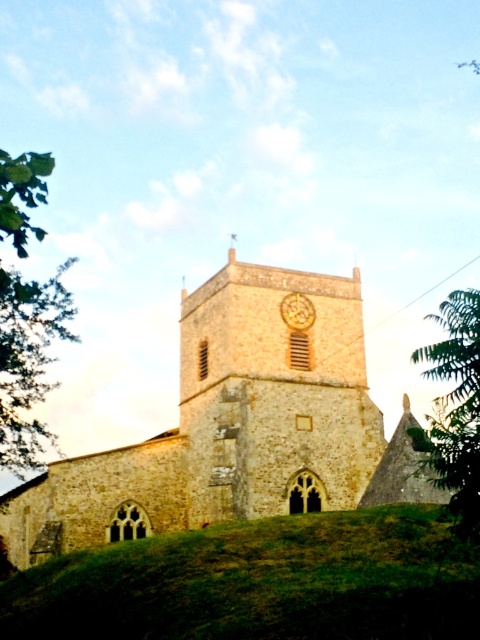
Does green grassy hill at lower center appear on the left side of gold textured clock at center?

Yes, green grassy hill at lower center is to the left of gold textured clock at center.

Is green grassy hill at lower center in front of gold textured clock at center?

That is True.

Is point (85, 605) farther from viewer compared to point (299, 305)?

That is False.

Locate an element on the screen. The image size is (480, 640). green grassy hill at lower center is located at coordinates (261, 582).

Between green grassy hill at lower center and stone clock tower at center, which one appears on the right side from the viewer's perspective?

Positioned to the right is stone clock tower at center.

Does green grassy hill at lower center lie in front of stone clock tower at center?

That is True.

Image resolution: width=480 pixels, height=640 pixels. Find the location of `green grassy hill at lower center`. green grassy hill at lower center is located at coordinates (261, 582).

Between green grassy hill at lower center and green leafy tree at left, which one is positioned lower?

green grassy hill at lower center is below.

Is green grassy hill at lower center positioned before green leafy tree at left?

Yes.

What do you see at coordinates (261, 582) in the screenshot?
I see `green grassy hill at lower center` at bounding box center [261, 582].

Where is `green grassy hill at lower center`? The height and width of the screenshot is (640, 480). green grassy hill at lower center is located at coordinates (261, 582).